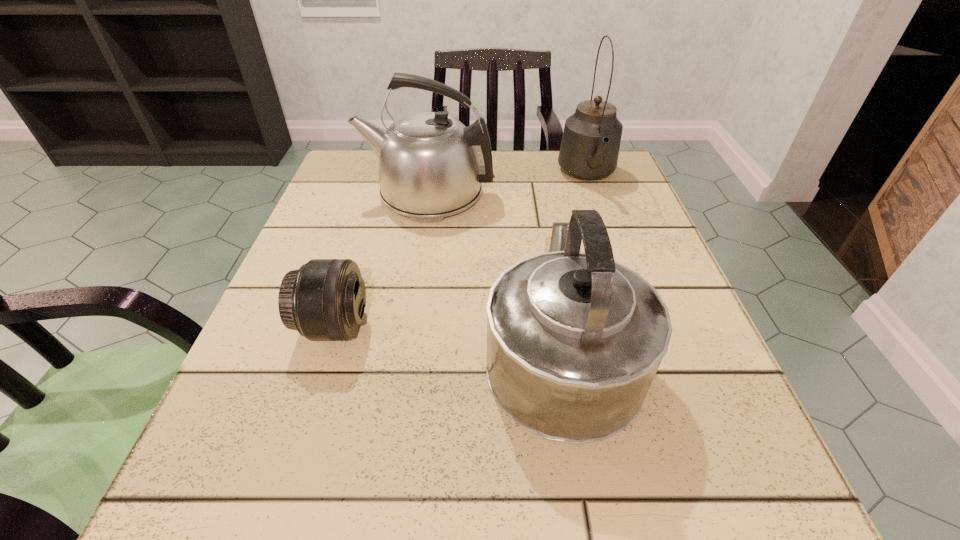
The image size is (960, 540). I want to click on free spot at the left edge of the desktop, so click(x=290, y=410).

I want to click on free spot at the right edge of the desktop, so click(672, 355).

The width and height of the screenshot is (960, 540). In the image, there is a desktop. Find the location of `vacant space at the far left corner`. vacant space at the far left corner is located at coordinates 337,184.

Locate an element on the screen. This screenshot has height=540, width=960. vacant space at the far right corner of the desktop is located at coordinates (639, 204).

At what (x,y) coordinates should I click in order to perform the action: click on blank region between the nearest kettle and the shortest object. Please return your answer as a coordinate pair (x, y). The width and height of the screenshot is (960, 540). Looking at the image, I should click on (447, 338).

You are a GUI agent. You are given a task and a screenshot of the screen. Output one action in this format:
    pyautogui.click(x=<x>, y=<y>)
    Task: Click on the vacant space that's between the shortest object and the nearest kettle
    This screenshot has height=540, width=960.
    Given the screenshot: What is the action you would take?
    pyautogui.click(x=447, y=338)

Locate an element on the screen. Image resolution: width=960 pixels, height=540 pixels. object that is the nearest to the shortest object is located at coordinates pyautogui.click(x=574, y=340).

Find the location of `object that stands as the third closest to the telephoto lens`. object that stands as the third closest to the telephoto lens is located at coordinates (590, 145).

Identify which kettle is located as the nearest to the nearest kettle. Please provide its 2D coordinates. Your answer should be formatted as a tuple, i.e. [(x, y)], where the tuple contains the x and y coordinates of a point satisfying the conditions above.

[(431, 165)]

Identify the location of kettle that is the second closest one to the nearest kettle. (590, 145).